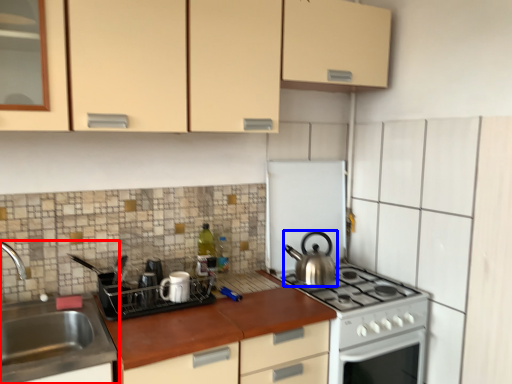
Question: Which object is closer to the camera taking this photo, sink (highlighted by a red box) or kitchen appliance (highlighted by a blue box)?

Choices:
 (A) sink
 (B) kitchen appliance

Answer: (A)